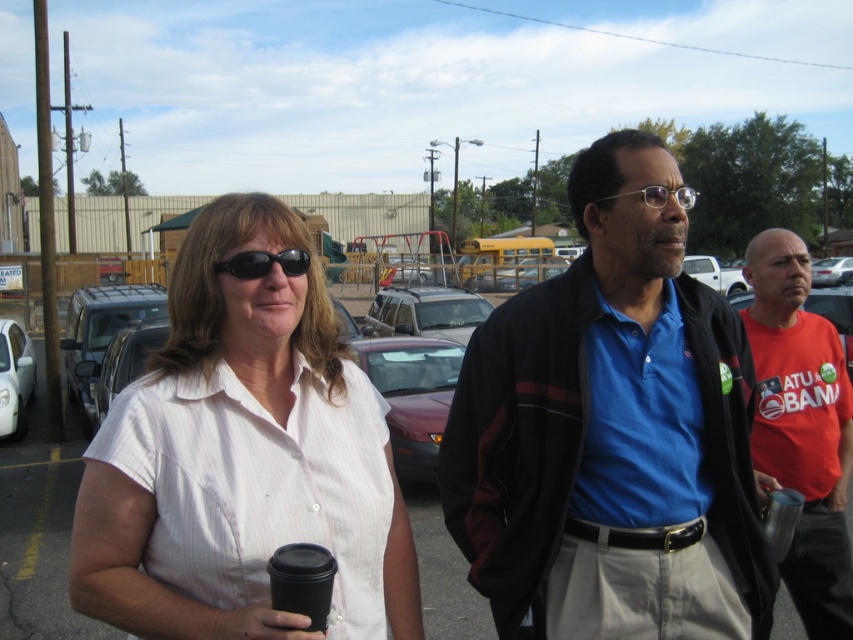
You are a delivery person trying to park your van in the parking lot. You see the white matte car at left and the white matte truck at center. Which vehicle should you avoid parking next to if you need more space for your van?

You should avoid parking next to the white matte truck at center because its width is greater than the white matte car at left, requiring more space.

In the scene shown: Based on the coordinates provided, which person is standing at point (610,433)?

The point (610,433) corresponds to the blue cotton shirt at center.

What is the exact coordinate of the white matte car at left?

The white matte car at left is located at coordinate point (15, 378).